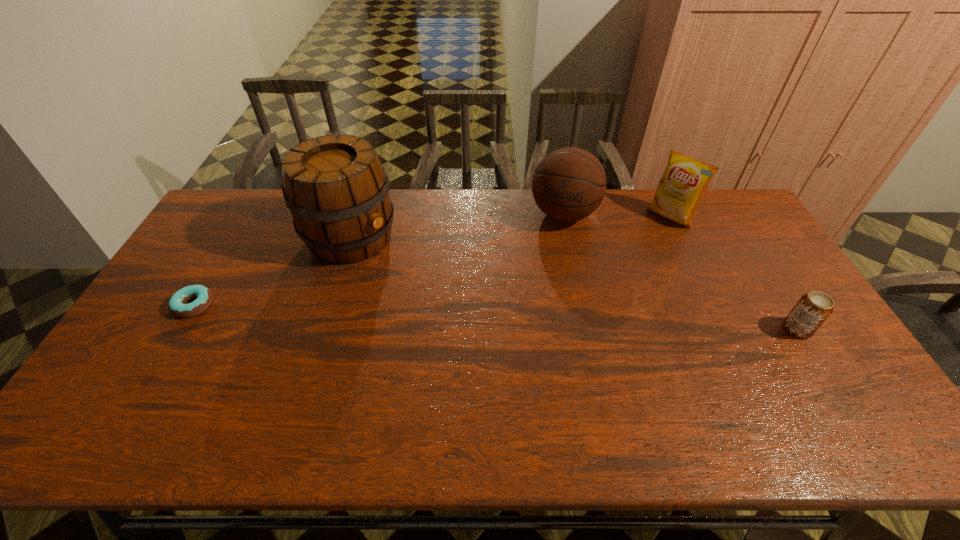
At what (x,y) coordinates should I click in order to perform the action: click on basketball present at the far edge. Please return your answer as a coordinate pair (x, y). The width and height of the screenshot is (960, 540). Looking at the image, I should click on (569, 184).

What are the coordinates of `crisp (potato chip) present at the far edge` in the screenshot? It's located at (681, 189).

The image size is (960, 540). What are the coordinates of `object present at the left edge` in the screenshot? It's located at (177, 306).

Identify the location of object that is at the right edge. (812, 310).

What are the coordinates of `vacant point at the far edge` in the screenshot? It's located at (515, 203).

Where is `vacant position at the near edge of the desktop`? This screenshot has width=960, height=540. vacant position at the near edge of the desktop is located at coordinates pyautogui.click(x=600, y=387).

This screenshot has width=960, height=540. I want to click on free region at the left edge of the desktop, so click(x=224, y=264).

Where is `free spot at the right edge of the desktop`? The width and height of the screenshot is (960, 540). free spot at the right edge of the desktop is located at coordinates coord(756,296).

Locate an element on the screen. This screenshot has width=960, height=540. vacant space in between the doughnut and the fourth object from left to right is located at coordinates (432, 261).

Find the location of a particular element. The image size is (960, 540). free space that is in between the crisp (potato chip) and the tallest object is located at coordinates (511, 227).